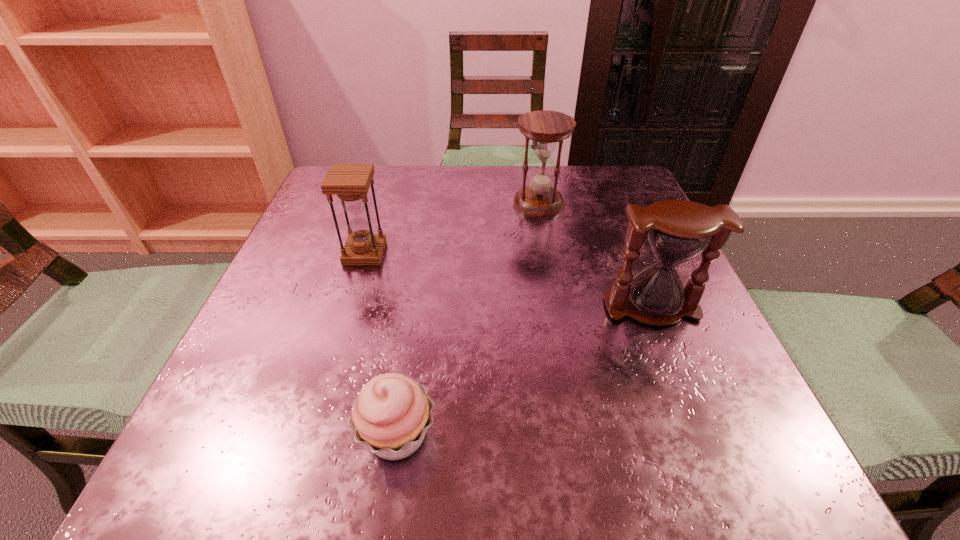
Where is `the second nearest object`? the second nearest object is located at coordinates (678, 230).

At what (x,y) coordinates should I click in order to perform the action: click on the nearest hourglass. Please return your answer as a coordinate pair (x, y). Image resolution: width=960 pixels, height=540 pixels. Looking at the image, I should click on (678, 230).

At what (x,y) coordinates should I click in order to perform the action: click on the third object from left to right. Please return your answer as a coordinate pair (x, y). This screenshot has height=540, width=960. Looking at the image, I should click on [x=545, y=127].

Identify the location of the farthest object. (x=545, y=127).

Locate an element on the screen. The width and height of the screenshot is (960, 540). the second farthest object is located at coordinates (350, 182).

Locate an element on the screen. The height and width of the screenshot is (540, 960). the leftmost object is located at coordinates (350, 182).

The width and height of the screenshot is (960, 540). I want to click on cupcake, so click(391, 415).

Find the location of a particular element. the nearest object is located at coordinates (391, 415).

The height and width of the screenshot is (540, 960). What are the coordinates of `vacant space located 0.350m on the back of the nearest hourglass` in the screenshot? It's located at (603, 186).

You are a GUI agent. You are given a task and a screenshot of the screen. Output one action in this format:
    pyautogui.click(x=<x>, y=<y>)
    Task: Click on the free region located on the right of the farthest hourglass
    This screenshot has height=540, width=960.
    Given the screenshot: What is the action you would take?
    pyautogui.click(x=649, y=204)